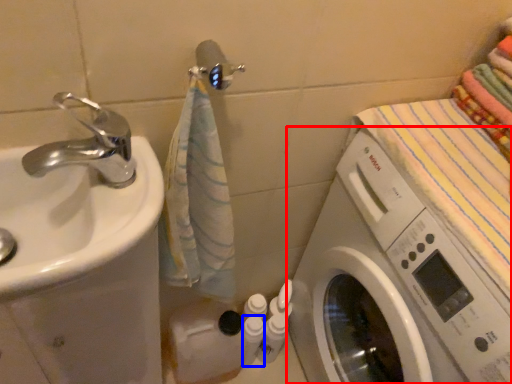
Question: Which of the following is the closest to the observer, washing machine (highlighted by a red box) or toiletry (highlighted by a blue box)?

Choices:
 (A) washing machine
 (B) toiletry

Answer: (A)